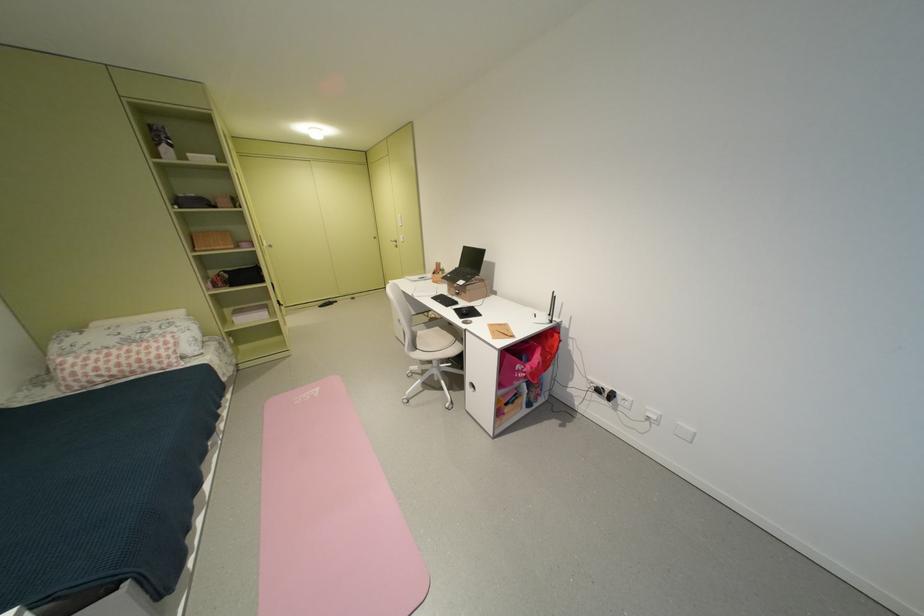
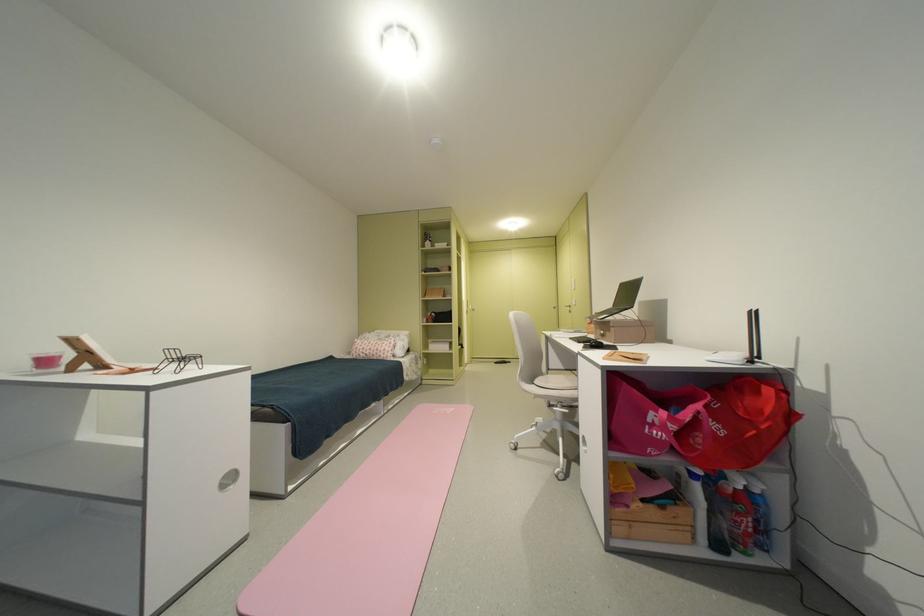
First-person continuous shooting, in which direction is the camera rotating?

The camera rotated toward left-up.